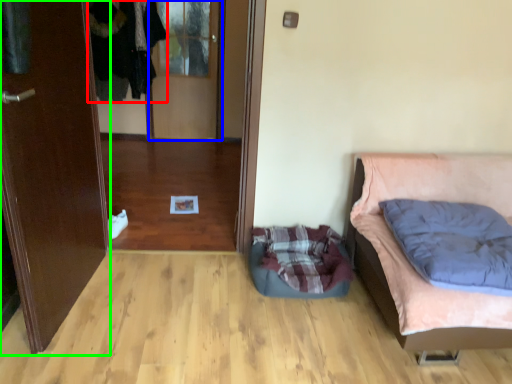
Question: Based on their relative distances, which object is nearer to clothing (highlighted by a red box)? Choose from glass door (highlighted by a blue box) and door (highlighted by a green box).

Choices:
 (A) glass door
 (B) door

Answer: (A)